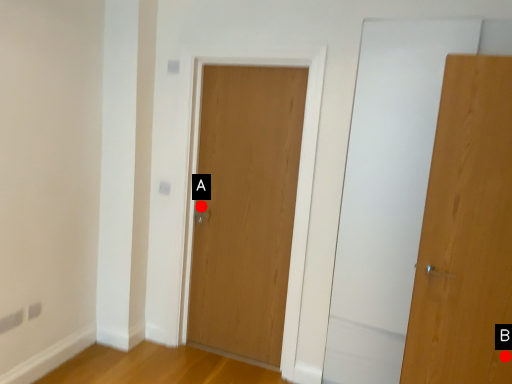
Question: Two points are circled on the image, labeled by A and B beside each circle. Which point is farther to the camera?

Choices:
 (A) A is further
 (B) B is further

Answer: (A)